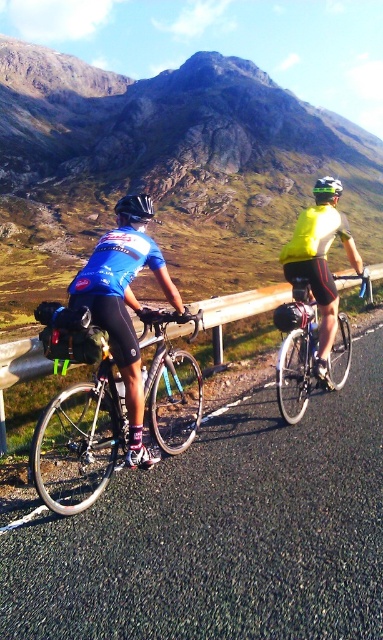
Question: Which object is farther from the camera taking this photo?

Choices:
 (A) yellow matte bicycle helmet at upper center
 (B) blue fabric jersey at center
 (C) brushed metal rail at center

Answer: (A)

Question: Can you confirm if shiny silver bicycle at right is wider than shiny black helmet at left?

Choices:
 (A) yes
 (B) no

Answer: (B)

Question: Which point is closer to the camera?

Choices:
 (A) (101, 275)
 (B) (222, 305)
 (C) (335, 186)
 (D) (309, 339)

Answer: (A)

Question: Which is nearer to the shiny black helmet at left?

Choices:
 (A) blue fabric jersey at center
 (B) shiny silver bicycle at right
 (C) yellow matte bicycle helmet at upper center

Answer: (B)

Question: Is shiny silver bicycle at right positioned at the back of brushed metal rail at center?

Choices:
 (A) yes
 (B) no

Answer: (B)

Question: Is black asphalt road at center above shiny black frame at left?

Choices:
 (A) yes
 (B) no

Answer: (B)